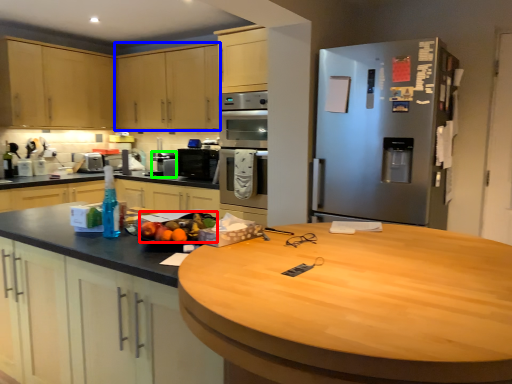
Question: Considering the real-world distances, which object is closest to fruit (highlighted by a red box)? cabinetry (highlighted by a blue box) or appliance (highlighted by a green box).

Choices:
 (A) cabinetry
 (B) appliance

Answer: (B)